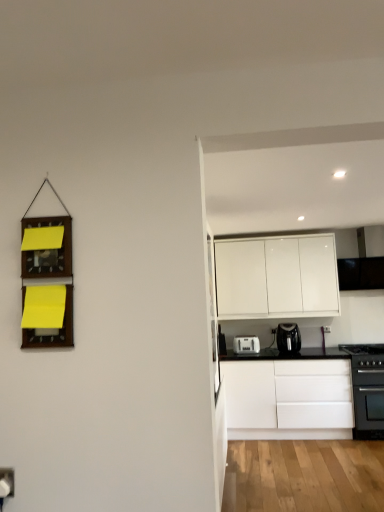
Question: Is black matte gas stove at right far from white plastic toaster at lower center, the 2th kitchen appliance in the right-to-left sequence?

Choices:
 (A) no
 (B) yes

Answer: (B)

Question: From the image's perspective, would you say black matte gas stove at right is positioned over white plastic toaster at lower center, the 1th kitchen appliance from the left?

Choices:
 (A) no
 (B) yes

Answer: (A)

Question: Could you tell me if black matte gas stove at right is facing white plastic toaster at lower center, the 1th kitchen appliance from the left?

Choices:
 (A) yes
 (B) no

Answer: (B)

Question: Would you say white plastic toaster at lower center, the 1th kitchen appliance from the left, is part of black matte gas stove at right's contents?

Choices:
 (A) yes
 (B) no

Answer: (B)

Question: Is black matte gas stove at right looking in the opposite direction of white plastic toaster at lower center, the 2th kitchen appliance in the right-to-left sequence?

Choices:
 (A) yes
 (B) no

Answer: (B)

Question: Looking at their shapes, would you say black matte gas stove at right is wider or thinner than white glossy cabinet at upper right, which appears as the 2th cabinetry when ordered from the bottom?

Choices:
 (A) wide
 (B) thin

Answer: (A)

Question: Is black matte gas stove at right inside or outside of white glossy cabinet at upper right, the 1th cabinetry from the top?

Choices:
 (A) outside
 (B) inside

Answer: (A)

Question: Visually, is black matte gas stove at right positioned to the left or to the right of white glossy cabinet at upper right, which appears as the 2th cabinetry when ordered from the bottom?

Choices:
 (A) right
 (B) left

Answer: (A)

Question: Is black matte gas stove at right in front of or behind white glossy cabinet at upper right, which appears as the 2th cabinetry when ordered from the bottom, in the image?

Choices:
 (A) behind
 (B) front

Answer: (B)

Question: Does point (360, 375) appear closer or farther from the camera than point (221, 248)?

Choices:
 (A) farther
 (B) closer

Answer: (B)

Question: In the image, is black matte oven at lower right positioned in front of or behind white glossy cabinet at upper right, the 1th cabinetry from the top?

Choices:
 (A) front
 (B) behind

Answer: (A)

Question: From the image's perspective, is black matte oven at lower right located above or below white glossy cabinet at upper right, the 1th cabinetry from the top?

Choices:
 (A) below
 (B) above

Answer: (A)

Question: Based on their sizes in the image, would you say black matte oven at lower right is bigger or smaller than white glossy cabinet at upper right, which appears as the 2th cabinetry when ordered from the bottom?

Choices:
 (A) small
 (B) big

Answer: (A)

Question: Is white glossy cabinet at upper right, the 1th cabinetry from the top, in front of or behind black matte gas stove at right in the image?

Choices:
 (A) front
 (B) behind

Answer: (B)

Question: Is white glossy cabinet at upper right, which appears as the 2th cabinetry when ordered from the bottom, spatially inside black matte gas stove at right, or outside of it?

Choices:
 (A) inside
 (B) outside

Answer: (B)